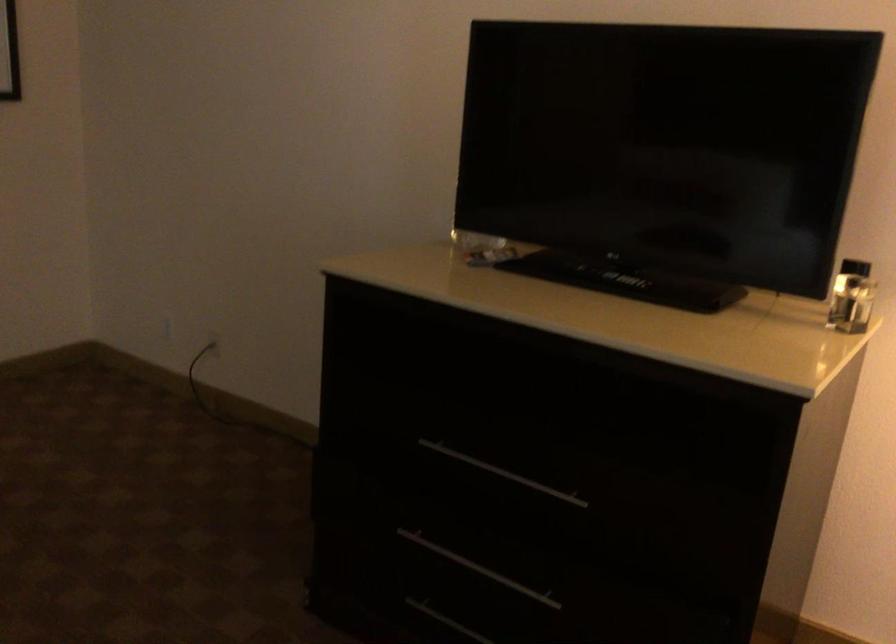
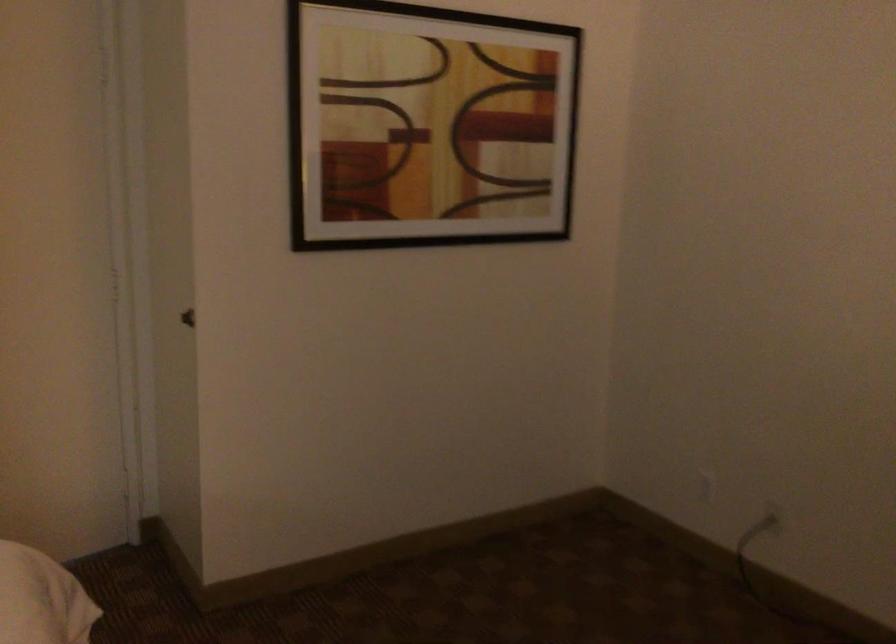
Locate, in the second image, the point that corresponds to point (183, 326) in the first image.

(707, 487)